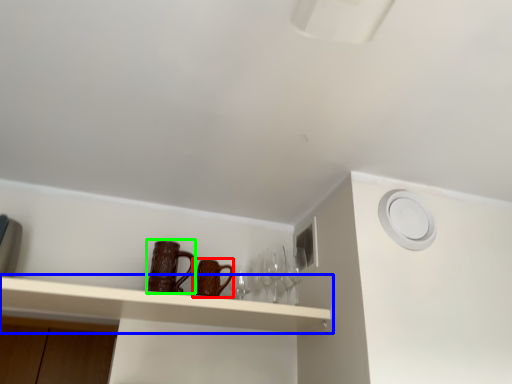
Question: Considering the real-world distances, which object is farthest from mug (highlighted by a red box)? shelf (highlighted by a blue box) or mug (highlighted by a green box)?

Choices:
 (A) shelf
 (B) mug

Answer: (A)